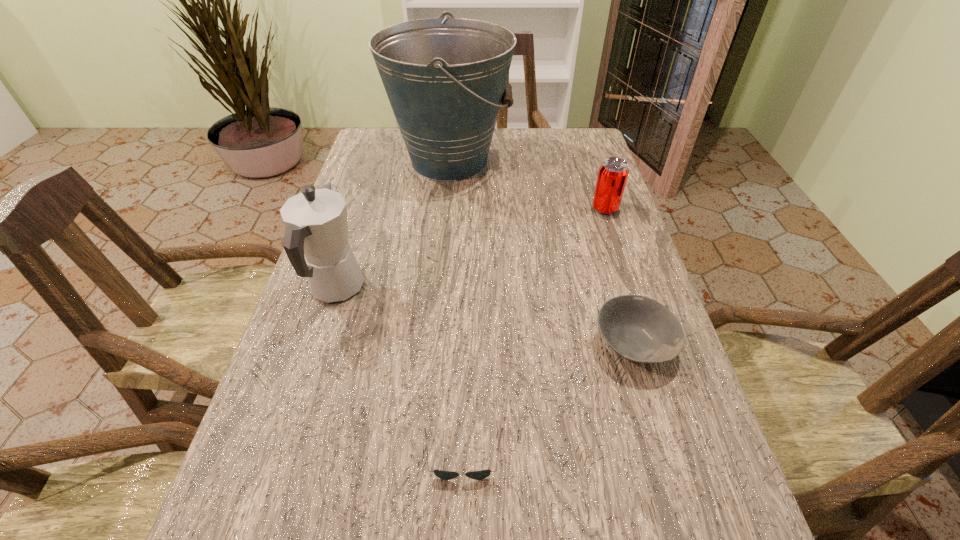
At what (x,y) coordinates should I click in order to perform the action: click on empty location between the fourth tallest object and the soda can. Please return your answer as a coordinate pair (x, y). The height and width of the screenshot is (540, 960). Looking at the image, I should click on (619, 276).

At what (x,y) coordinates should I click in order to perform the action: click on empty space that is in between the fourth tallest object and the nearest object. Please return your answer as a coordinate pair (x, y). Looking at the image, I should click on (548, 400).

Locate an element on the screen. Image resolution: width=960 pixels, height=540 pixels. free point between the bowl and the second farthest object is located at coordinates (619, 276).

At what (x,y) coordinates should I click in order to perform the action: click on object that can be found as the third closest to the fourth shortest object. Please return your answer as a coordinate pair (x, y). Looking at the image, I should click on (639, 329).

Where is `the second closest object to the coffeepot`? This screenshot has width=960, height=540. the second closest object to the coffeepot is located at coordinates (445, 475).

Find the location of a particular element. The image size is (960, 540). free spot that satisfies the following two spatial constraints: 1. with the handle on opposite sides of the farthest object; 2. on the left side of the third tallest object is located at coordinates (445, 208).

This screenshot has height=540, width=960. In order to click on vacant space that satisfies the following two spatial constraints: 1. on the front side of the coffeepot; 2. on the right side of the fourth tallest object in this screenshot , I will do `click(319, 345)`.

Locate an element on the screen. The image size is (960, 540). free space in the image that satisfies the following two spatial constraints: 1. with the handle on opposite sides of the bucket; 2. on the right side of the soda can is located at coordinates [x=445, y=208].

Image resolution: width=960 pixels, height=540 pixels. I want to click on free space that satisfies the following two spatial constraints: 1. on the back side of the third tallest object; 2. on the right side of the coffeepot, so click(362, 208).

This screenshot has width=960, height=540. In order to click on vacant region that satisfies the following two spatial constraints: 1. with the handle on opposite sides of the second shortest object; 2. on the left side of the tallest object in this screenshot , I will do `click(432, 345)`.